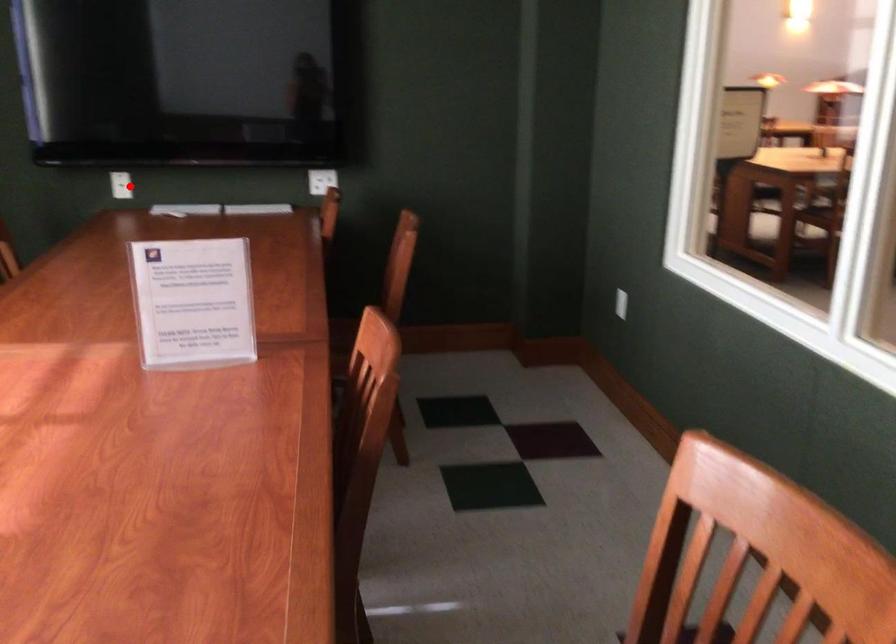
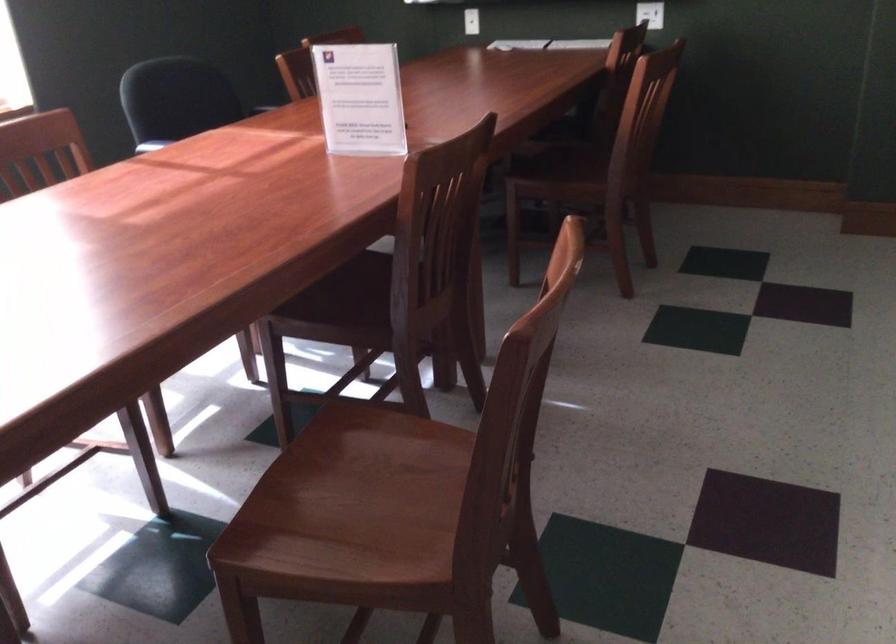
Find the pixel in the second image that matches the highlighted location in the first image.

(471, 21)